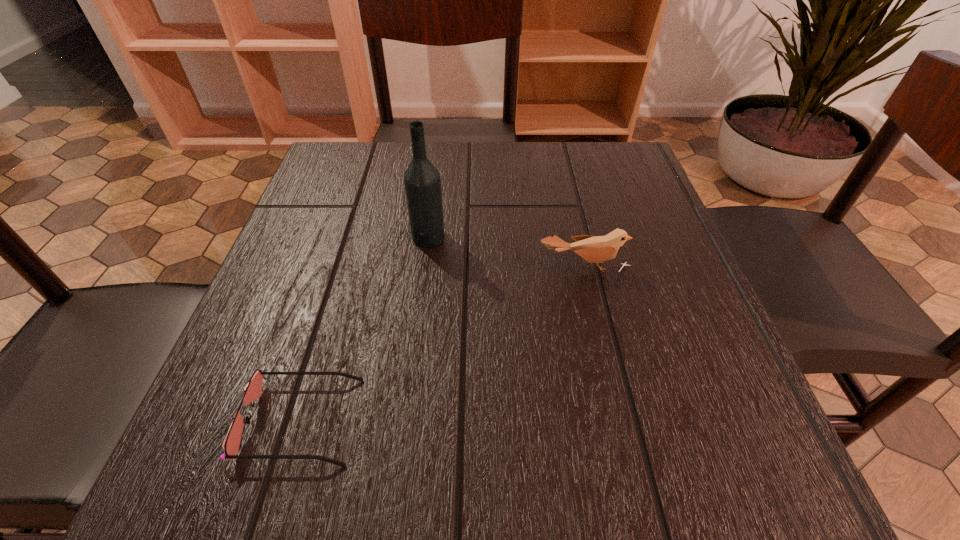
Locate an element on the screen. The height and width of the screenshot is (540, 960). object positioned at the left edge is located at coordinates (252, 391).

Where is `object present at the right edge`? object present at the right edge is located at coordinates (594, 249).

I want to click on object present at the near left corner, so click(252, 391).

In the image, there is a desktop. At what (x,y) coordinates should I click in order to perform the action: click on vacant space at the far edge. Please return your answer as a coordinate pair (x, y). Looking at the image, I should click on (396, 179).

I want to click on blank space at the near edge of the desktop, so click(325, 452).

Where is `free space at the left edge of the desktop`? Image resolution: width=960 pixels, height=540 pixels. free space at the left edge of the desktop is located at coordinates (347, 252).

Find the location of a particular element. The image size is (960, 540). free spot at the right edge of the desktop is located at coordinates (632, 284).

Image resolution: width=960 pixels, height=540 pixels. In the image, there is a desktop. Find the location of `vacant space at the far left corner`. vacant space at the far left corner is located at coordinates (335, 180).

I want to click on blank space at the far right corner of the desktop, so click(618, 152).

Where is `vacant area that lies between the tallest object and the shortest object`? This screenshot has height=540, width=960. vacant area that lies between the tallest object and the shortest object is located at coordinates (365, 329).